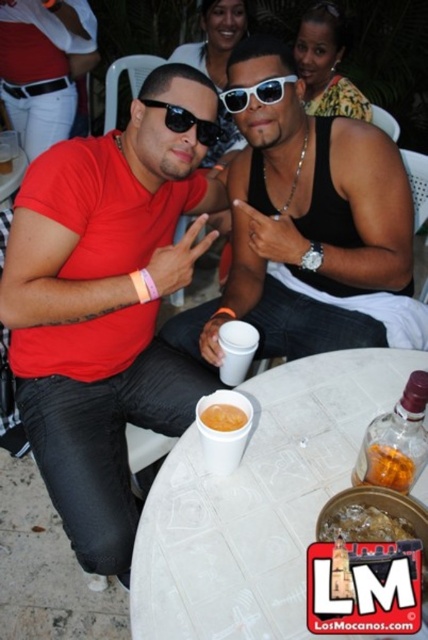
Is matte red shirt at center to the left of yellow matte cupcake at center from the viewer's perspective?

Yes, matte red shirt at center is to the left of yellow matte cupcake at center.

In the scene shown: Can you confirm if matte red shirt at center is positioned to the right of yellow matte cupcake at center?

No, matte red shirt at center is not to the right of yellow matte cupcake at center.

Is point (9, 120) positioned after point (225, 408)?

Yes, it is.

Where is `matte red shirt at center`? matte red shirt at center is located at coordinates (44, 67).

Is point (187, 520) behind point (273, 88)?

No.

Which of these two, white tile table at center or white plastic sunglasses at center, stands shorter?

white plastic sunglasses at center

The image size is (428, 640). In order to click on white tile table at center in this screenshot , I will do `click(258, 502)`.

Image resolution: width=428 pixels, height=640 pixels. Identify the location of white tile table at center. (258, 502).

Is white plastic sunglasses at center bigger than white plastic table at center?

Incorrect, white plastic sunglasses at center is not larger than white plastic table at center.

Measure the distance between point (229, 97) and camera.

They are 4.24 feet apart.

Where is `white plastic sunglasses at center`? The width and height of the screenshot is (428, 640). white plastic sunglasses at center is located at coordinates (255, 93).